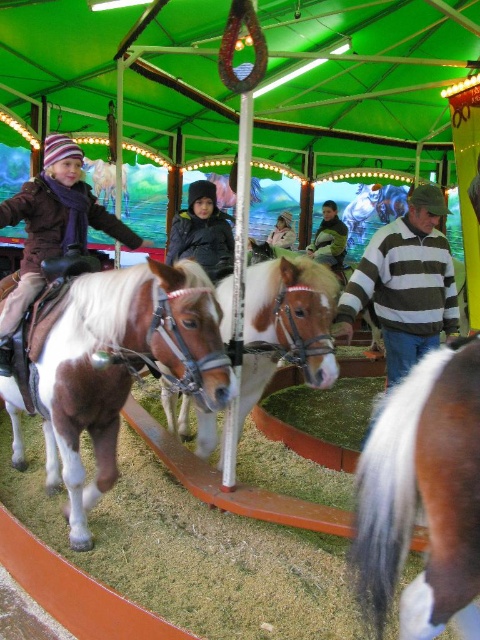
Question: Can you confirm if matte brown jacket at left is positioned above dark green sweater at center?

Choices:
 (A) yes
 (B) no

Answer: (B)

Question: Which point appears closest to the camera in this image?

Choices:
 (A) (301, 340)
 (B) (454, 456)

Answer: (B)

Question: Can you confirm if brown glossy horse at center is wider than light brown leather jacket at center?

Choices:
 (A) no
 (B) yes

Answer: (B)

Question: Which object is positioned farthest from the light brown leather jacket at center?

Choices:
 (A) dark gray fabric jacket at center
 (B) brown glossy horse at left

Answer: (B)

Question: Which object is farther from the camera taking this photo?

Choices:
 (A) striped sweater at center
 (B) brown glossy horse at center

Answer: (A)

Question: Does brown glossy horse at left come in front of brown and white horse at center?

Choices:
 (A) no
 (B) yes

Answer: (B)